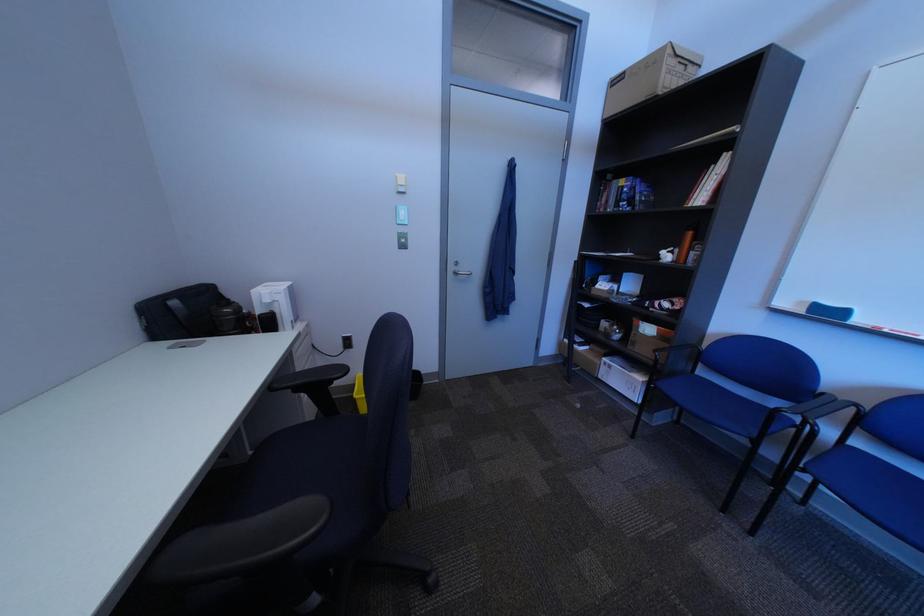
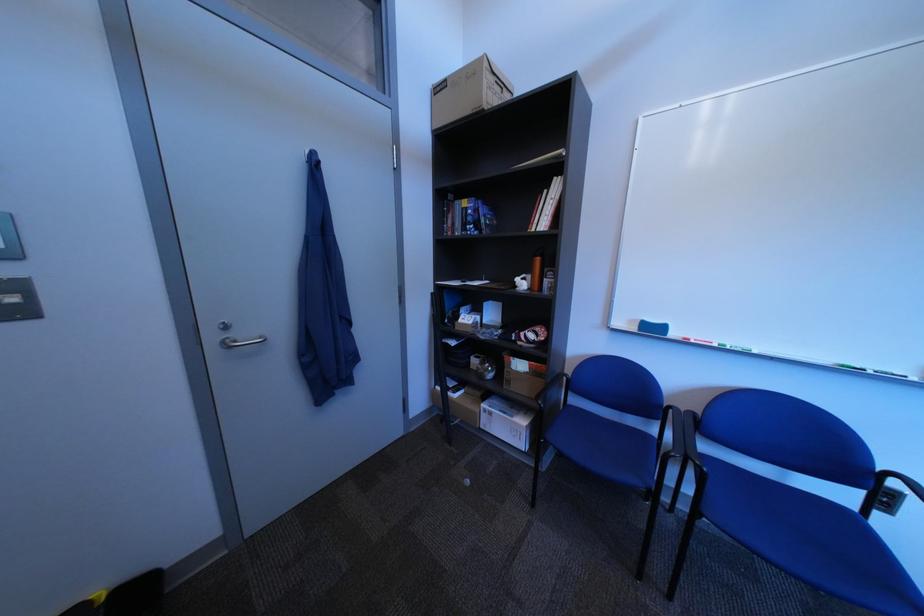
Where in the second image is the point corresponding to point (671, 389) from the first image?

(561, 442)